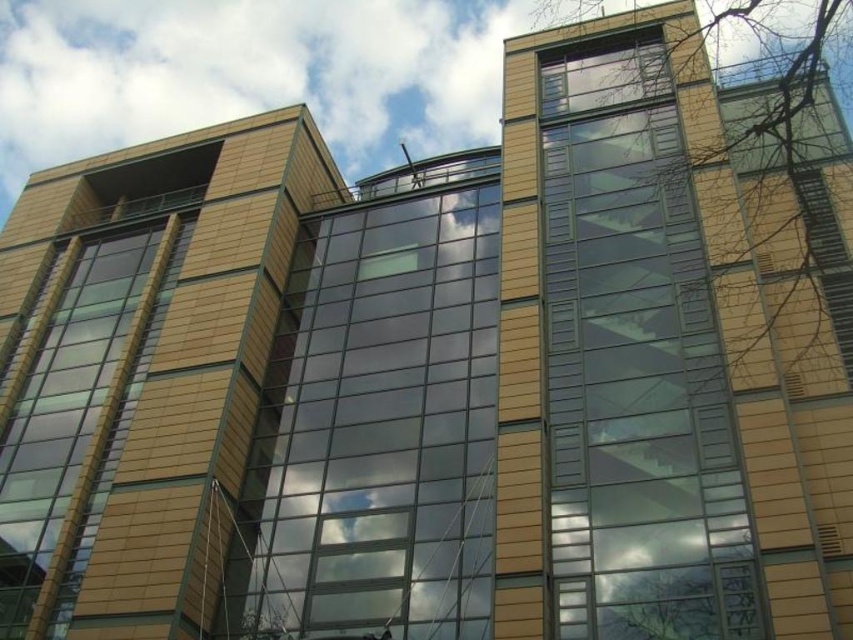
Question: Can you confirm if transparent glass window at upper right is positioned to the right of matte glass window at left?

Choices:
 (A) yes
 (B) no

Answer: (A)

Question: Does transparent glass window at center appear over matte glass window at left?

Choices:
 (A) no
 (B) yes

Answer: (B)

Question: From the image, what is the correct spatial relationship of transparent glass window at upper right in relation to transparent glass window at center?

Choices:
 (A) right
 (B) left

Answer: (A)

Question: Which point appears closest to the camera in this image?

Choices:
 (A) (102, 394)
 (B) (561, 321)
 (C) (397, 573)

Answer: (C)

Question: Which object appears farthest from the camera in this image?

Choices:
 (A) transparent glass window at center
 (B) matte glass window at left
 (C) transparent glass window at upper right

Answer: (B)

Question: Which object is closer to the camera taking this photo?

Choices:
 (A) transparent glass window at center
 (B) matte glass window at left
 (C) transparent glass window at upper right

Answer: (C)